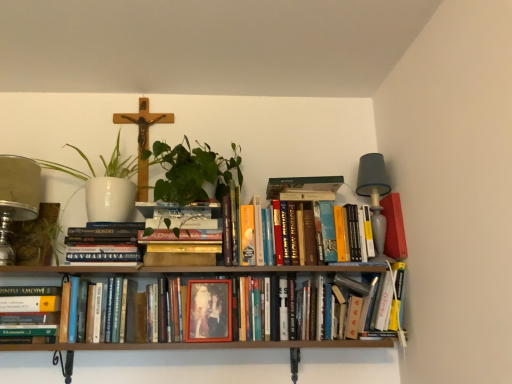
Question: Is white ceramic pot at upper left aimed at wooden crucifix at upper center?

Choices:
 (A) yes
 (B) no

Answer: (B)

Question: Does white ceramic pot at upper left have a greater height compared to wooden crucifix at upper center?

Choices:
 (A) no
 (B) yes

Answer: (A)

Question: Does white ceramic pot at upper left lie in front of wooden crucifix at upper center?

Choices:
 (A) no
 (B) yes

Answer: (B)

Question: Can you confirm if white ceramic pot at upper left is shorter than wooden crucifix at upper center?

Choices:
 (A) yes
 (B) no

Answer: (A)

Question: Is wooden crucifix at upper center located within white ceramic pot at upper left?

Choices:
 (A) no
 (B) yes

Answer: (B)

Question: Is white ceramic pot at upper left to the right of wooden crucifix at upper center from the viewer's perspective?

Choices:
 (A) no
 (B) yes

Answer: (A)

Question: Is hardcover books at center, the third book viewed from the right, positioned beyond the bounds of wooden crucifix at upper center?

Choices:
 (A) yes
 (B) no

Answer: (A)

Question: Is hardcover books at center, marked as the 2th book in a left-to-right arrangement, bigger than wooden crucifix at upper center?

Choices:
 (A) yes
 (B) no

Answer: (A)

Question: Does hardcover books at center, marked as the 2th book in a left-to-right arrangement, have a lesser width compared to wooden crucifix at upper center?

Choices:
 (A) yes
 (B) no

Answer: (B)

Question: Is hardcover books at center, marked as the 2th book in a left-to-right arrangement, positioned far away from wooden crucifix at upper center?

Choices:
 (A) yes
 (B) no

Answer: (B)

Question: Does hardcover books at center, marked as the 2th book in a left-to-right arrangement, have a greater height compared to wooden crucifix at upper center?

Choices:
 (A) yes
 (B) no

Answer: (B)

Question: Does hardcover books at center, the third book viewed from the right, turn towards wooden crucifix at upper center?

Choices:
 (A) yes
 (B) no

Answer: (B)

Question: Considering the relative sizes of wooden crucifix at upper center and matte plastic photo frame at center, which ranks as the second paperback book in right-to-left order, in the image provided, is wooden crucifix at upper center thinner than matte plastic photo frame at center, which ranks as the second paperback book in right-to-left order,?

Choices:
 (A) yes
 (B) no

Answer: (B)